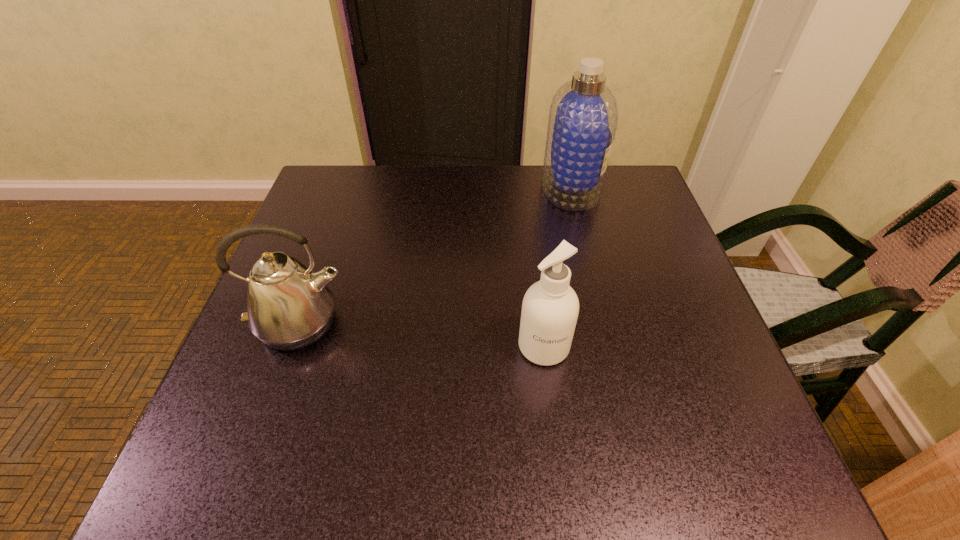
Find the location of a particular element. Image resolution: width=960 pixels, height=540 pixels. free space between the farther cleansing agent and the leftmost object is located at coordinates (436, 255).

This screenshot has width=960, height=540. I want to click on unoccupied area between the taller cleansing agent and the kettle, so click(x=436, y=255).

Identify the location of free space between the leftmost object and the nearer cleansing agent. The image size is (960, 540). (422, 335).

In order to click on object that is the closest one to the leftmost object in this screenshot , I will do `click(550, 308)`.

The image size is (960, 540). Identify the location of the closest object to the shorter cleansing agent. (289, 307).

This screenshot has height=540, width=960. In order to click on vacant space that satisfies the following two spatial constraints: 1. on the back side of the taller cleansing agent; 2. on the left side of the leftmost object in this screenshot , I will do point(349,188).